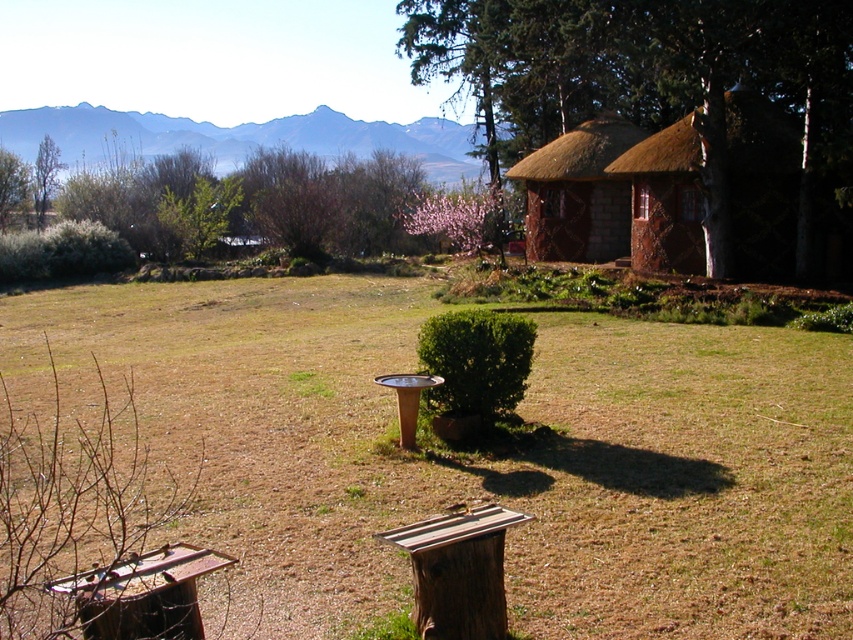
You are standing at the edge of the grassy area and want to walk towards the thatched wood hut at right. To avoid stepping on the brown wooden stump at lower center, which direction should you move relative to the stump?

The thatched wood hut at right is above the brown wooden stump at lower center, so you should move to the left or right side of the stump to avoid stepping on it while walking towards the hut.

You are standing at the thatched roof hut and looking towards the water feature. Which point, point (811,116) or point (540,189), is closer to you?

Point (811,116) is closer to you because it is in front of point (540,189).